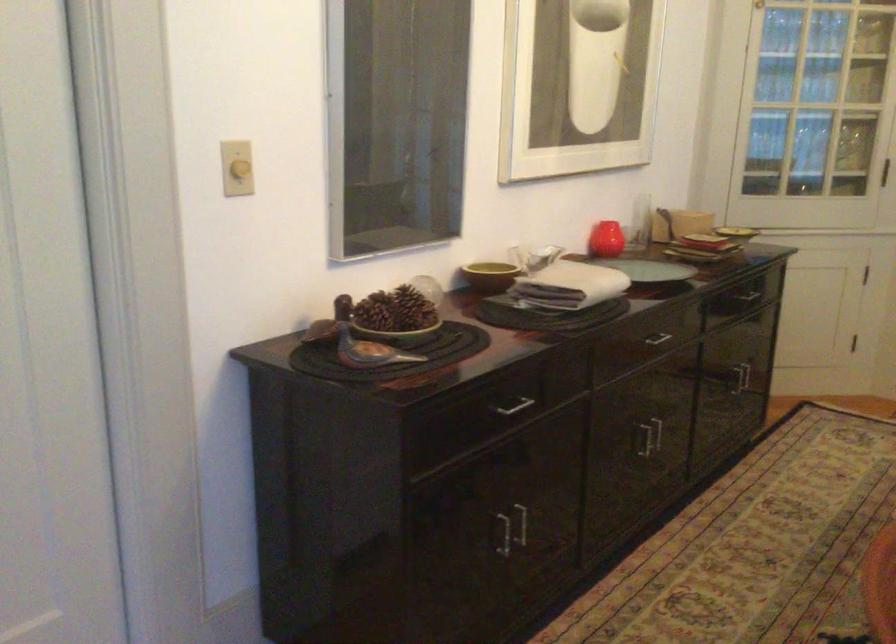
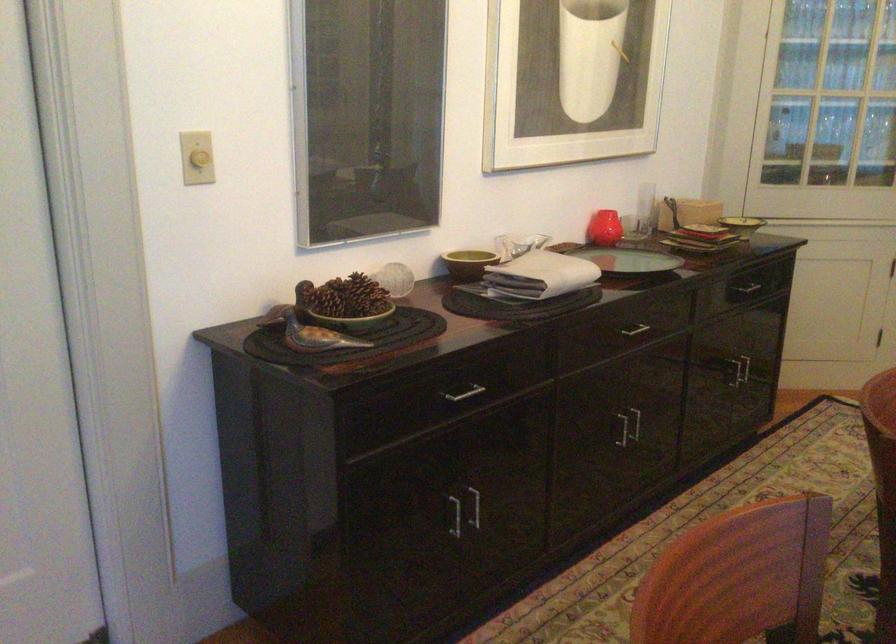
In the second image, find the point that corresponds to point 644,440 in the first image.

(623, 429)